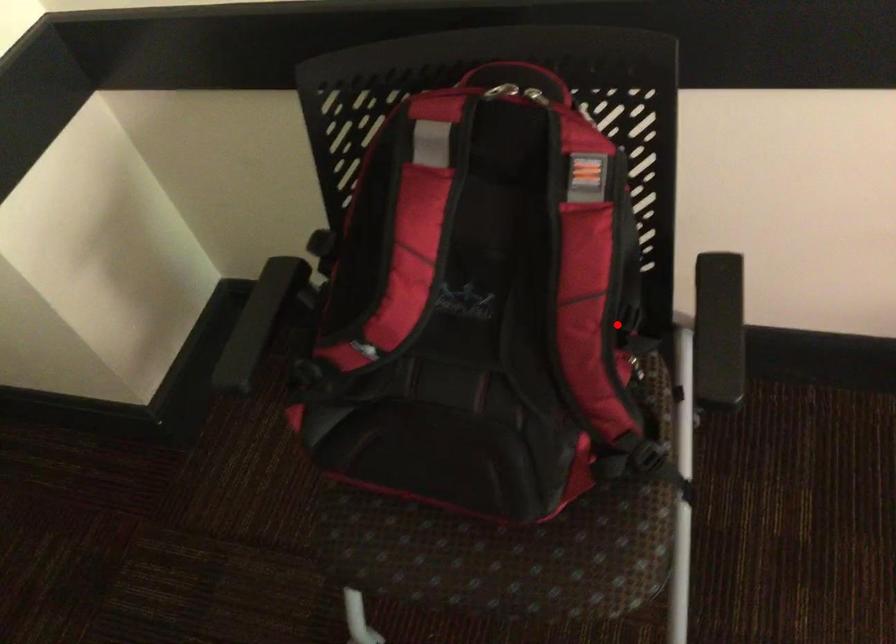
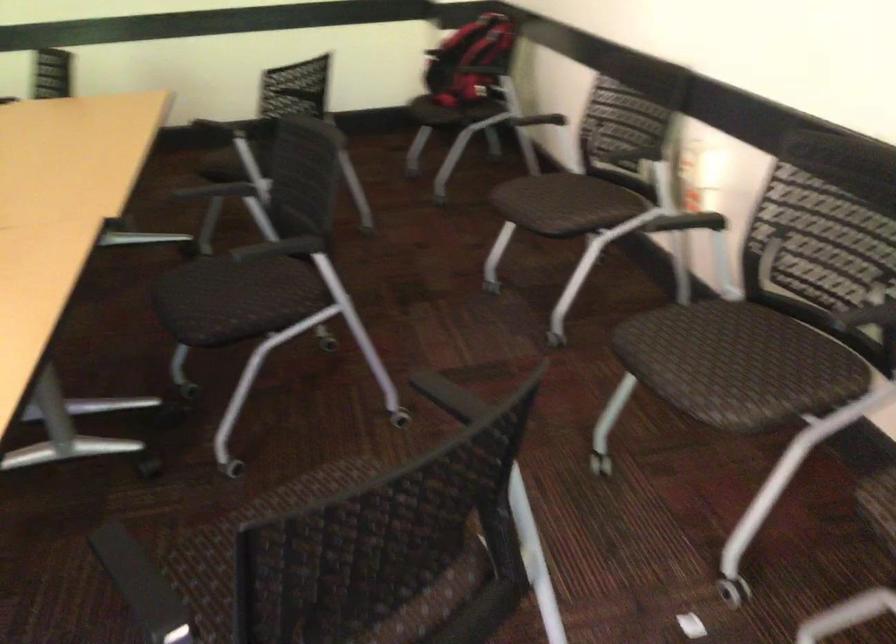
Question: I am providing you with two images of the same scene from different viewpoints. Given a red point in image1, look at the same physical point in image2. Is it:

Choices:
 (A) Closer to the viewpoint
 (B) Farther from the viewpoint

Answer: (B)